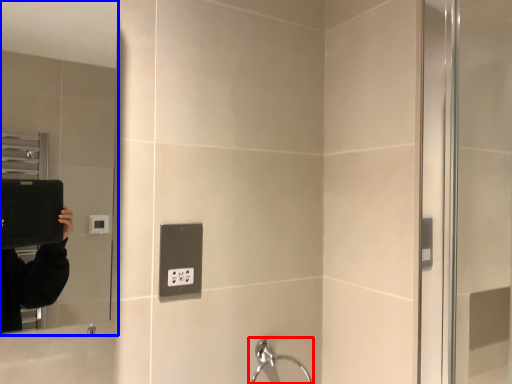
Question: Among these objects, which one is nearest to the camera, faucet (highlighted by a red box) or mirror (highlighted by a blue box)?

Choices:
 (A) faucet
 (B) mirror

Answer: (B)